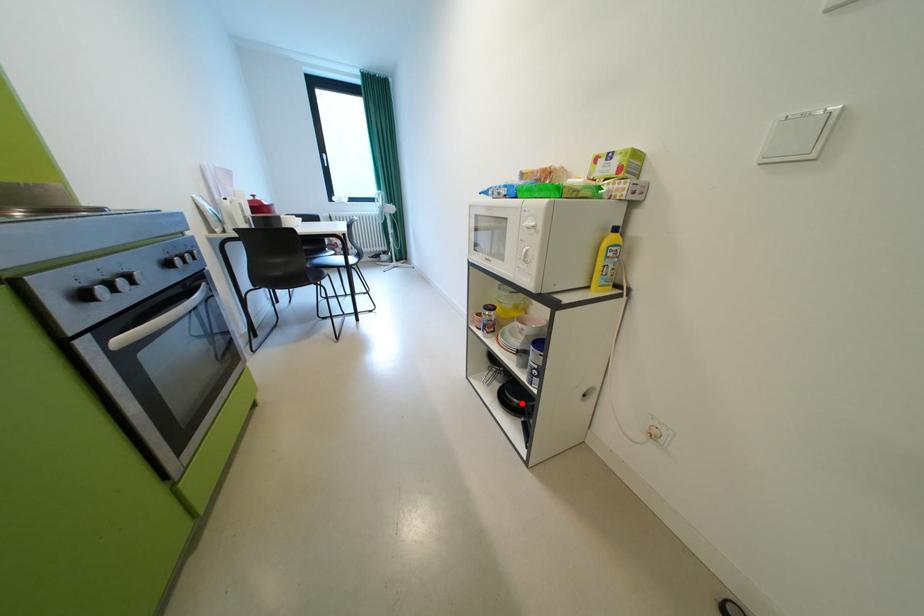
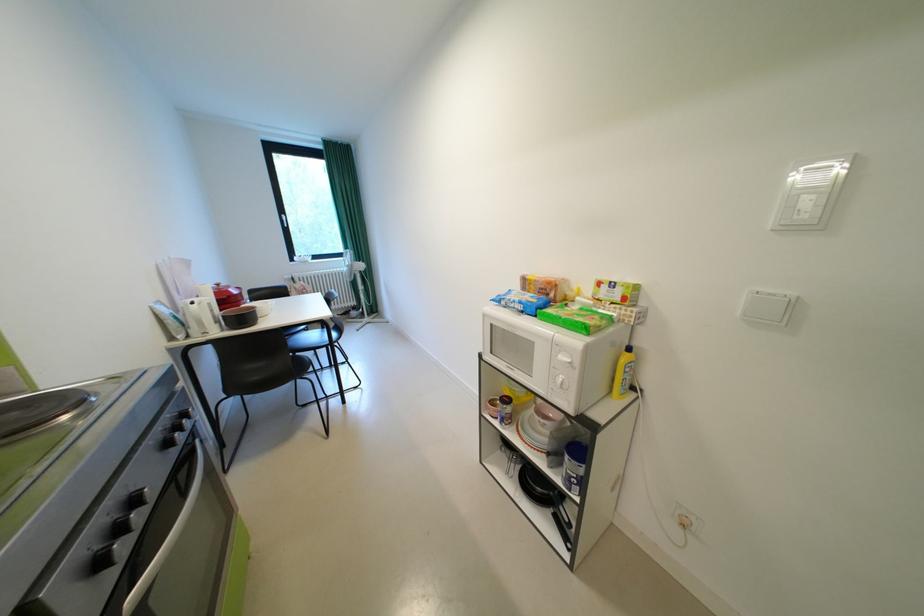
Question: A red point is marked in image1. In image2, is the corresponding 3D point closer to the camera or farther? Reply with the corresponding letter.

Choices:
 (A) The corresponding 3D point is closer.
 (B) The corresponding 3D point is farther.

Answer: (B)